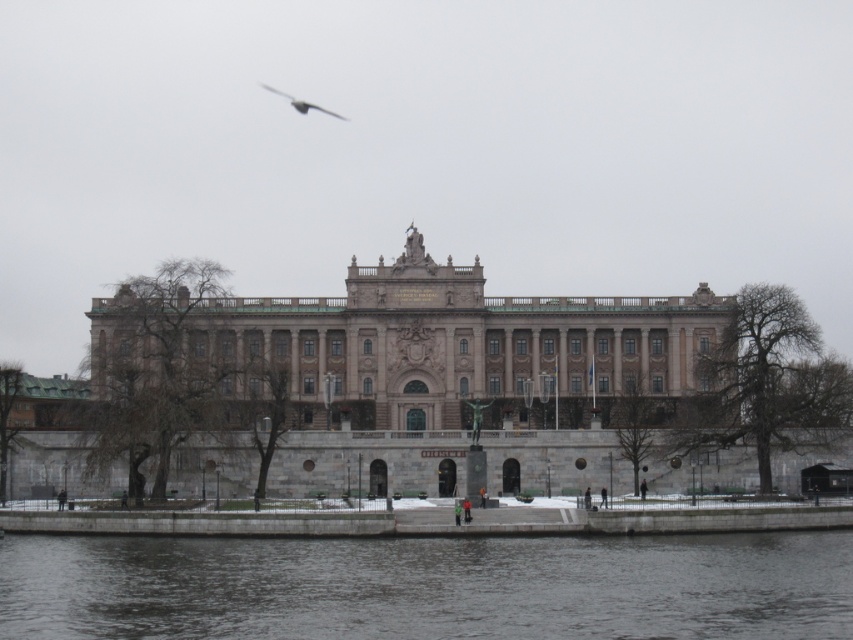
Question: From the image, what is the correct spatial relationship of beige stone palace at center in relation to gray feathered bird at upper center?

Choices:
 (A) right
 (B) left

Answer: (A)

Question: Can you confirm if gray concrete river at lower center is smaller than gray feathered bird at upper center?

Choices:
 (A) yes
 (B) no

Answer: (B)

Question: Which point is closer to the camera?

Choices:
 (A) gray feathered bird at upper center
 (B) beige stone palace at center

Answer: (B)

Question: Does beige stone palace at center have a lesser width compared to gray feathered bird at upper center?

Choices:
 (A) no
 (B) yes

Answer: (A)

Question: Which object appears closest to the camera in this image?

Choices:
 (A) gray concrete river at lower center
 (B) gray feathered bird at upper center

Answer: (A)

Question: Among these points, which one is farthest from the camera?

Choices:
 (A) (325, 109)
 (B) (473, 355)
 (C) (519, 632)

Answer: (A)